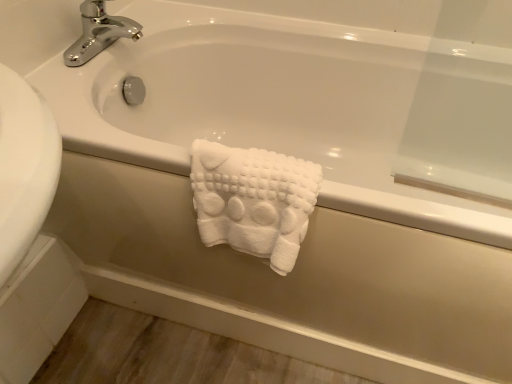
Where is `unoccupied space behind chrome/metallic faucet at upper left`? unoccupied space behind chrome/metallic faucet at upper left is located at coordinates (134, 19).